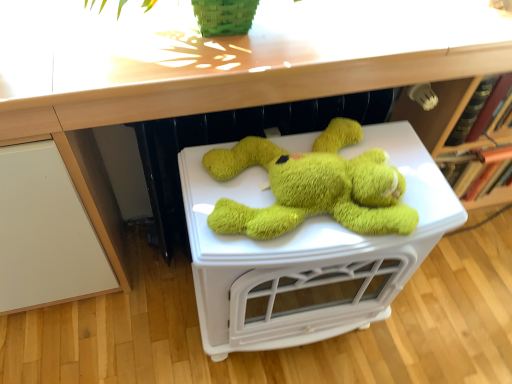
In order to face wooden at upper center, should I rotate leftwards or rightwards?

Rotate your view right by about 6.384°.

What do you see at coordinates (229, 58) in the screenshot? I see `wooden at upper center` at bounding box center [229, 58].

From the picture: Measure the distance between point (101, 72) and camera.

They are 27.24 inches apart.

Measure the distance between wooden at upper center and camera.

The depth of wooden at upper center is 24.84 inches.

Locate an element on the screen. The image size is (512, 384). wooden at upper center is located at coordinates (229, 58).

Describe the element at coordinates (306, 242) in the screenshot. I see `soft green plush toy at center` at that location.

Locate an element on the screen. This screenshot has width=512, height=384. soft green plush toy at center is located at coordinates (306, 242).

In order to face soft green plush toy at center, should I rotate leftwards or rightwards?

Rotate right and turn 4.720 degrees.

Identify the location of wooden at upper center. This screenshot has height=384, width=512. (229, 58).

Does soft green plush toy at center appear on the right side of wooden at upper center?

No.

Which object is closer to the camera taking this photo, soft green plush toy at center or wooden at upper center?

wooden at upper center.

Between point (323, 189) and point (398, 27), which one is positioned in front?

The point (323, 189) is closer to the camera.

From the image's perspective, which one is positioned higher, soft green plush toy at center or wooden at upper center?

wooden at upper center is shown above in the image.

From a real-world perspective, between soft green plush toy at center and wooden at upper center, who is vertically higher?

From a 3D spatial view, wooden at upper center is above.

Consider the image. Considering the sizes of objects soft green plush toy at center and wooden at upper center in the image provided, who is wider, soft green plush toy at center or wooden at upper center?

Wider between the two is wooden at upper center.

In the scene shown: Which of these two, soft green plush toy at center or wooden at upper center, stands taller?

With more height is soft green plush toy at center.

Considering the sizes of objects soft green plush toy at center and wooden at upper center in the image provided, who is smaller, soft green plush toy at center or wooden at upper center?

Smaller between the two is wooden at upper center.

Is soft green plush toy at center located outside wooden at upper center?

soft green plush toy at center lies outside wooden at upper center's area.

Are soft green plush toy at center and wooden at upper center beside each other?

No, soft green plush toy at center is not touching wooden at upper center.

Is wooden at upper center at the back of soft green plush toy at center?

No, soft green plush toy at center's orientation is not away from wooden at upper center.

Identify the location of table directly beneath the wooden at upper center (from a real-world perspective). (306, 242).

Does wooden at upper center appear on the left side of soft green plush toy at center?

In fact, wooden at upper center is to the right of soft green plush toy at center.

Which is behind, wooden at upper center or soft green plush toy at center?

soft green plush toy at center is more distant.

Considering the points (132, 71) and (275, 334), which point is behind, point (132, 71) or point (275, 334)?

The point (275, 334) is farther from the camera.

From the image's perspective, relative to soft green plush toy at center, is wooden at upper center above or below?

wooden at upper center is above soft green plush toy at center.

From a real-world perspective, does wooden at upper center stand above soft green plush toy at center?

Yes.

Looking at their sizes, would you say wooden at upper center is wider or thinner than soft green plush toy at center?

In the image, wooden at upper center appears to be wider than soft green plush toy at center.

Looking at this image, between wooden at upper center and soft green plush toy at center, which one has less height?

With less height is wooden at upper center.

Can you confirm if wooden at upper center is bigger than soft green plush toy at center?

Incorrect, wooden at upper center is not larger than soft green plush toy at center.

Would you say wooden at upper center is outside soft green plush toy at center?

wooden at upper center is positioned outside soft green plush toy at center.

Would you say wooden at upper center is a long distance from soft green plush toy at center?

No, wooden at upper center is in close proximity to soft green plush toy at center.

Consider the image. Is wooden at upper center facing away from soft green plush toy at center?

No, wooden at upper center is not facing away from soft green plush toy at center.

What's the angular difference between wooden at upper center and soft green plush toy at center's facing directions?

1.38 degrees.

Where is `table on the left of wooden at upper center`? This screenshot has width=512, height=384. table on the left of wooden at upper center is located at coordinates (306, 242).

Find the location of a particular element. table located on the left of wooden at upper center is located at coordinates (306, 242).

At what (x,y) coordinates should I click in order to perform the action: click on counter top in front of the soft green plush toy at center. Please return your answer as a coordinate pair (x, y). Image resolution: width=512 pixels, height=384 pixels. Looking at the image, I should click on (229, 58).